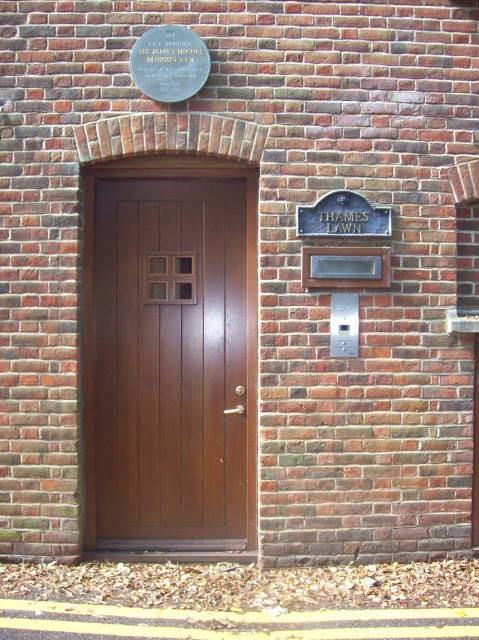
You are a delivery person trying to find the correct entrance. You see the brown wooden door at center and the black metal sign at upper right. According to the sign, where should you go to reach the entrance?

The brown wooden door at center is located below the black metal sign at upper right, so the entrance is likely beneath the sign where the door is situated.

You are a delivery person standing 5 feet away from the brown wooden door at center. You need to read the black metal sign at upper right. Can you reach it without moving closer?

The distance between the brown wooden door at center and the black metal sign at upper right is 30.94 inches. Since you are already 5 feet away from the door, the total distance to the sign would be 5 feet plus 30.94 inches. Converting 5 feet to inches gives 60 inches, so total distance is 60 inches plus 30.94 inches equals 90.94 inches. Therefore, you are too far to read the sign without moving closer.